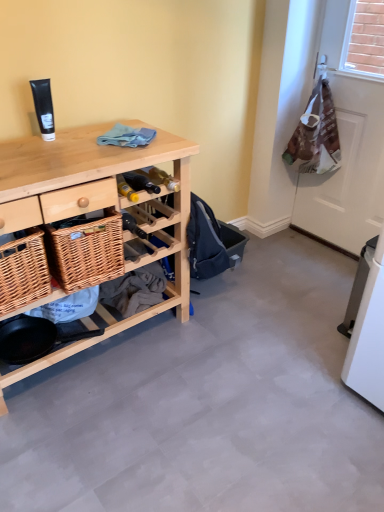
What are the coordinates of `vacant space in blue cotton cloth at center (from a real-world perspective)` in the screenshot? It's located at 141,137.